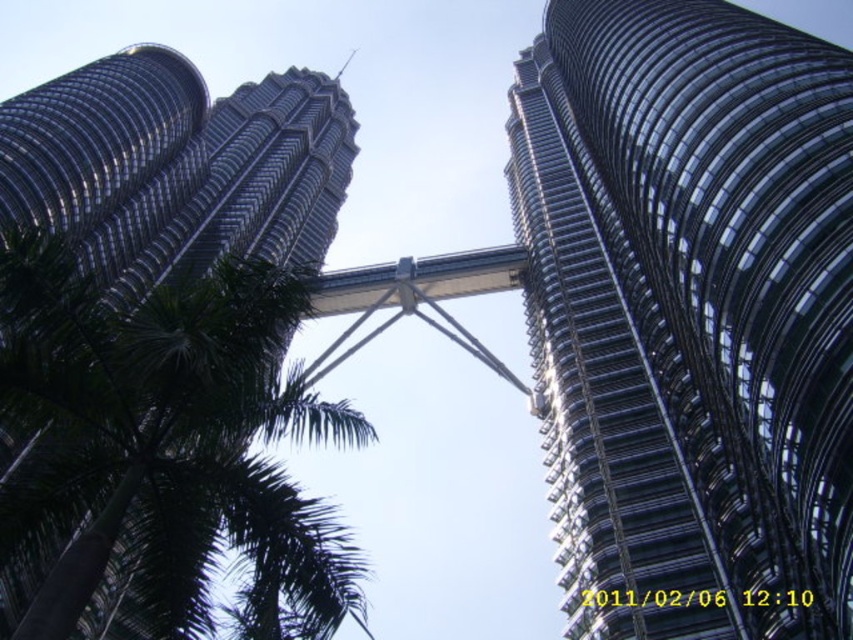
You are standing in front of the Petronas Twin Towers and notice two towers in the image. Which one is shorter between the glassy steel tower at center and the shiny metallic tower at upper left?

The glassy steel tower at center is smaller than the shiny metallic tower at upper left, so it is the shorter one.

You are standing at the base of the glassy steel tower at center and the shiny metallic tower at upper left. Which tower is positioned higher in the sky?

The glassy steel tower at center is located above the shiny metallic tower at upper left, so it is positioned higher in the sky.